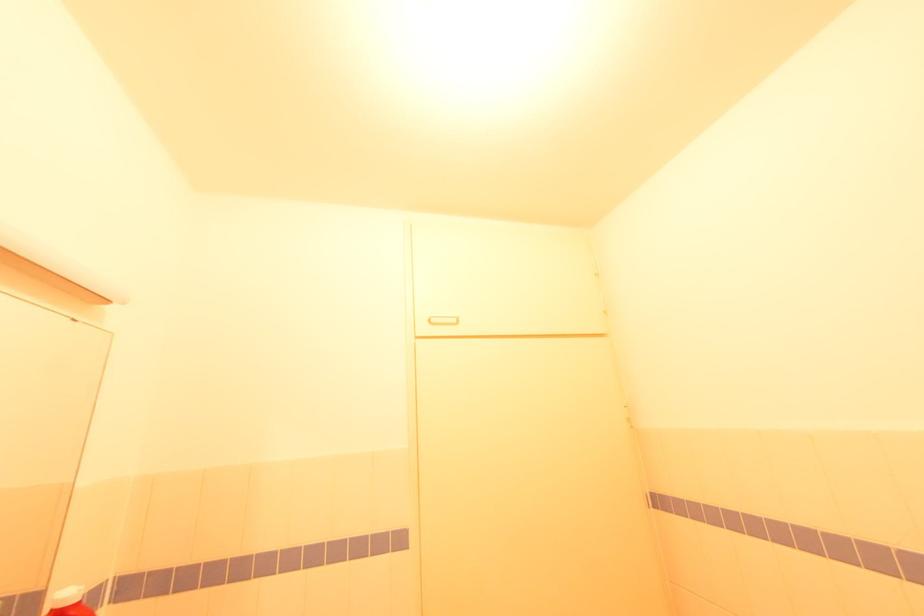
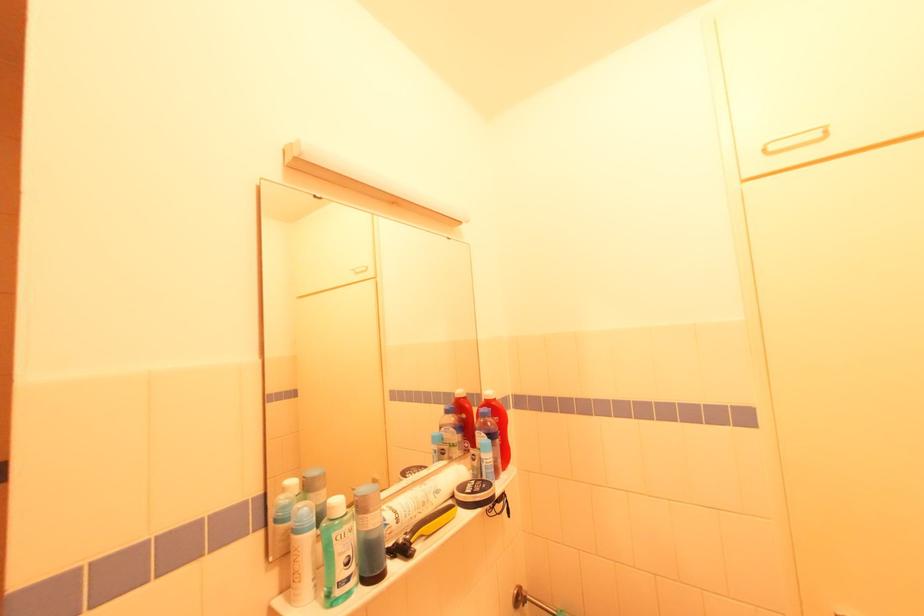
In the second image, find the point that corresponds to [435,321] in the first image.

(773, 148)